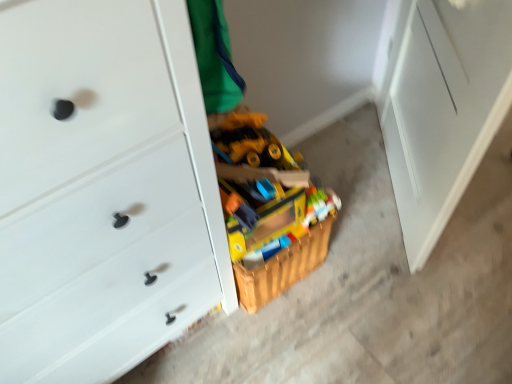
Question: From the image's perspective, is white matte chest of drawers at center positioned above or below wooden toy box at center?

Choices:
 (A) above
 (B) below

Answer: (A)

Question: From a real-world perspective, is white matte chest of drawers at center physically located above or below wooden toy box at center?

Choices:
 (A) below
 (B) above

Answer: (B)

Question: Which object is the closest to the wooden toy box at center?

Choices:
 (A) white matte file cabinet at right
 (B) white matte chest of drawers at center

Answer: (B)

Question: Which object is the farthest from the wooden toy box at center?

Choices:
 (A) white matte file cabinet at right
 (B) white matte chest of drawers at center

Answer: (A)